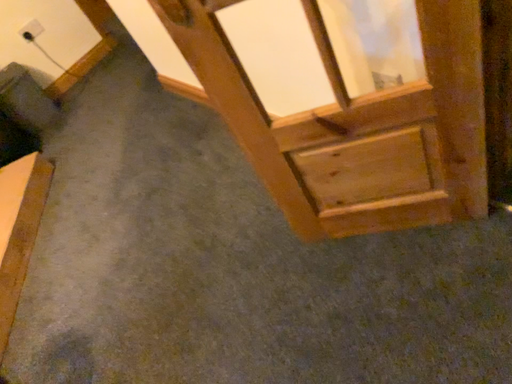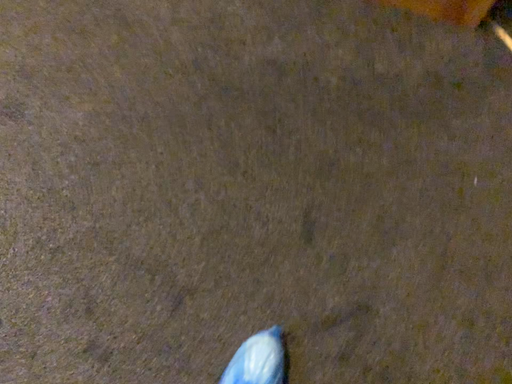
Question: How did the camera likely rotate when shooting the video?

Choices:
 (A) rotated right
 (B) rotated left

Answer: (A)